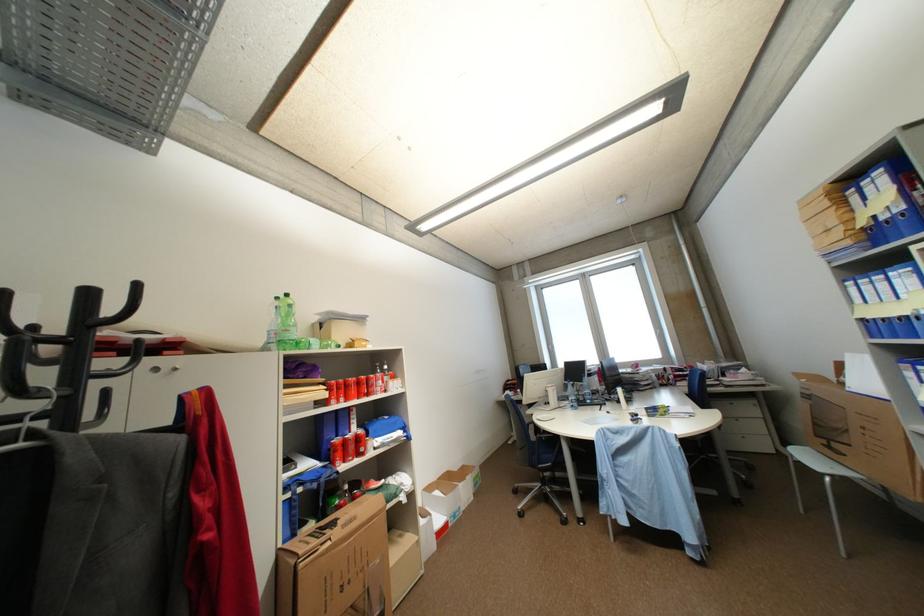
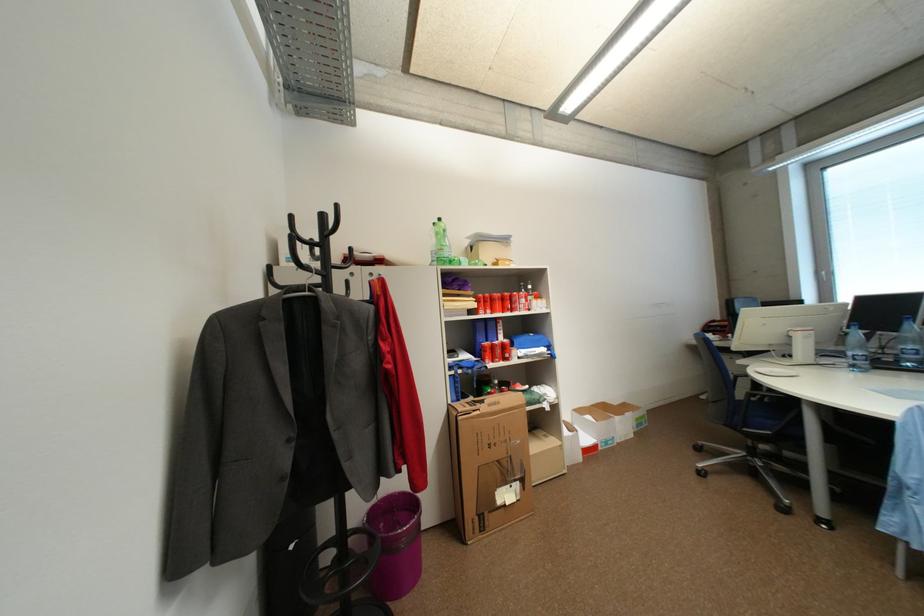
Locate, in the second image, the point that corresponds to [353,444] in the first image.

(502, 347)